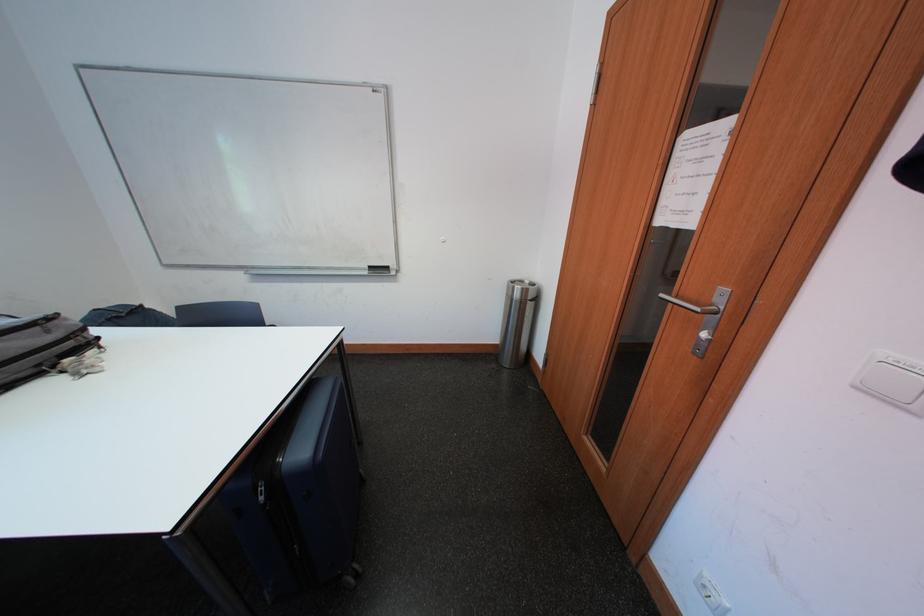
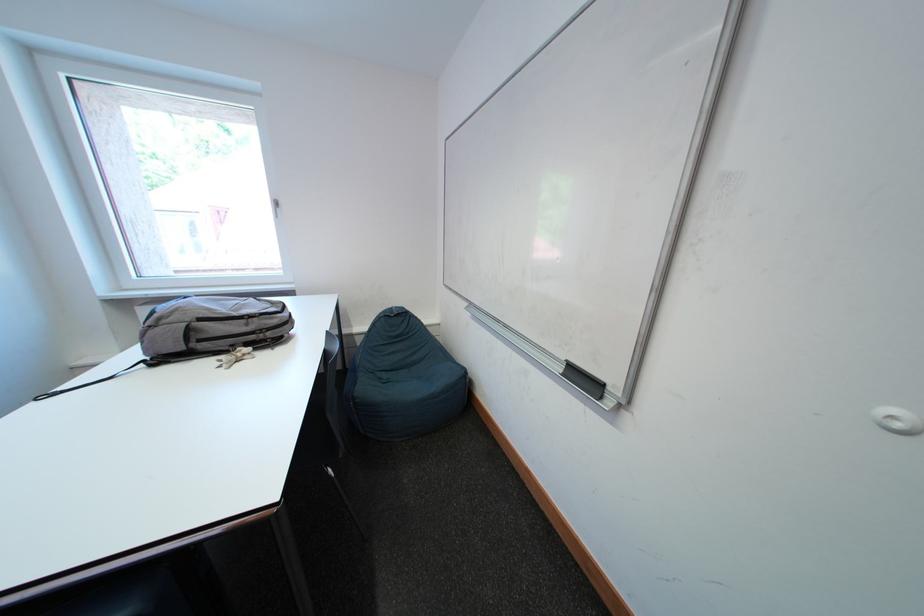
In the second image, find the point that corresponds to point 49,369 in the first image.

(241, 349)